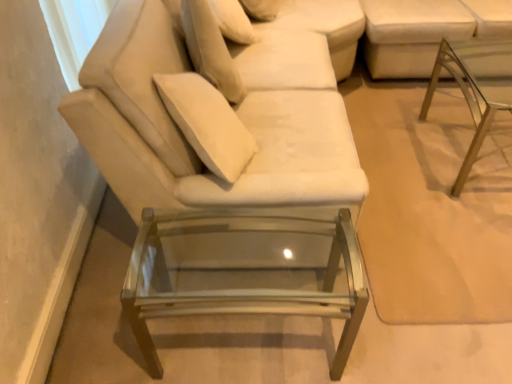
Question: Looking at the image, does transparent glass table at right, marked as the first table in a top-to-bottom arrangement, seem bigger or smaller compared to clear glass table at lower center, which is the 2th table in right-to-left order?

Choices:
 (A) big
 (B) small

Answer: (A)

Question: Is transparent glass table at right, marked as the first table in a top-to-bottom arrangement, taller or shorter than clear glass table at lower center, which is the 2th table in right-to-left order?

Choices:
 (A) short
 (B) tall

Answer: (B)

Question: Considering the real-world distances, which object is closest to the white fabric couch at upper right?

Choices:
 (A) clear glass table at lower center, acting as the first table starting from the left
 (B) velvet beige couch at center
 (C) transparent glass table at right, marked as the 2th table in a left-to-right arrangement
 (D) velvet beige pillow at upper center

Answer: (C)

Question: Based on their relative distances, which object is farther from the transparent glass table at right, placed as the second table when sorted from bottom to top?

Choices:
 (A) velvet beige couch at center
 (B) white fabric couch at upper right
 (C) clear glass table at lower center, which is the 2th table in right-to-left order
 (D) velvet beige pillow at upper center

Answer: (C)